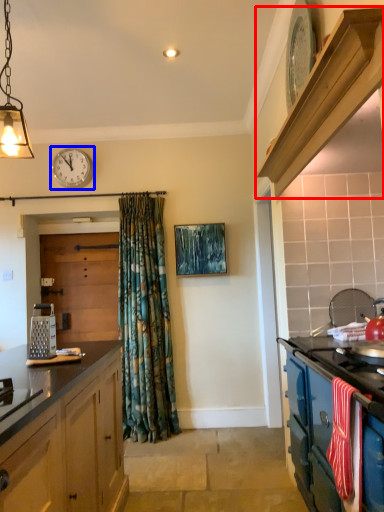
Question: Which of the following is the farthest to the observer, shelf (highlighted by a red box) or clock (highlighted by a blue box)?

Choices:
 (A) shelf
 (B) clock

Answer: (B)